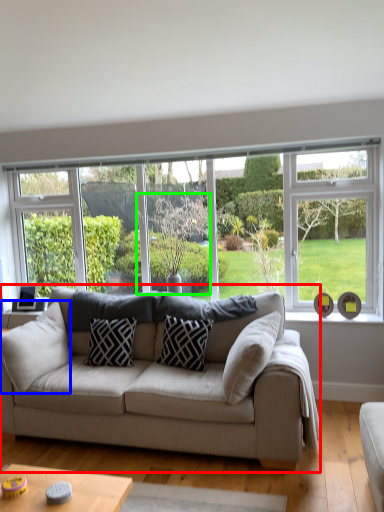
Question: Based on their relative distances, which object is nearer to studio couch (highlighted by a red box)? Choose from pillow (highlighted by a blue box) and tree (highlighted by a green box).

Choices:
 (A) pillow
 (B) tree

Answer: (A)